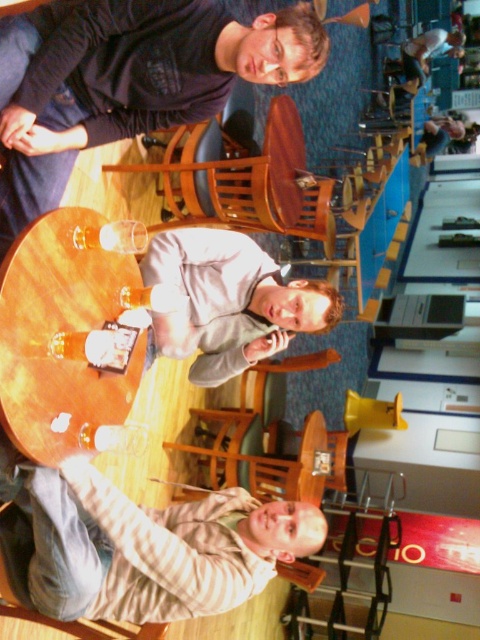
Is point (95, 68) positioned before point (31, 356)?

That is False.

Is matte black hoodie at upper center positioned behind wooden table at center?

Yes, it is behind wooden table at center.

Is point (103, 115) positioned behind point (81, 280)?

Yes.

Find the location of a particular element. matte black hoodie at upper center is located at coordinates (127, 81).